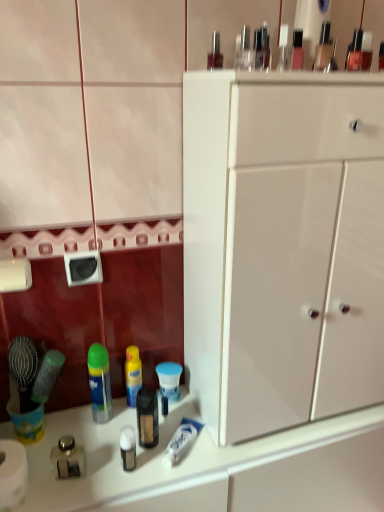
This screenshot has width=384, height=512. In order to click on free space above white glossy counter top at lower left (from a real-world perspective) in this screenshot , I will do `click(158, 440)`.